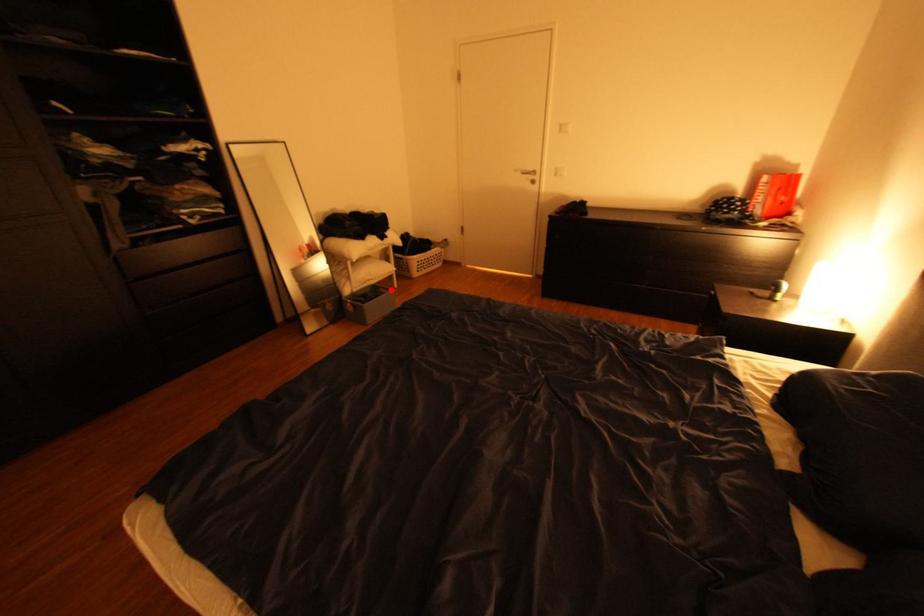
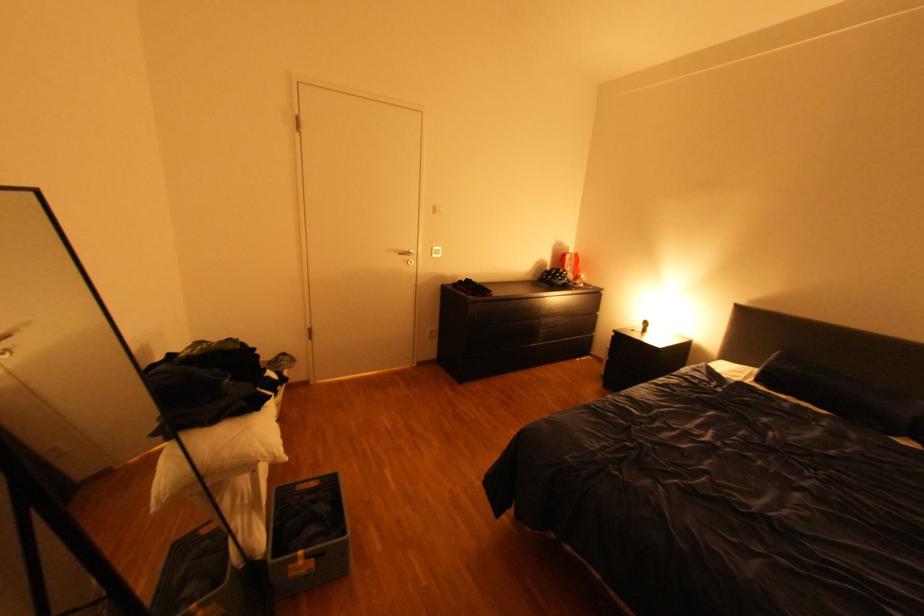
Find the pixel in the second image that matches the highlighted location in the first image.

(310, 488)